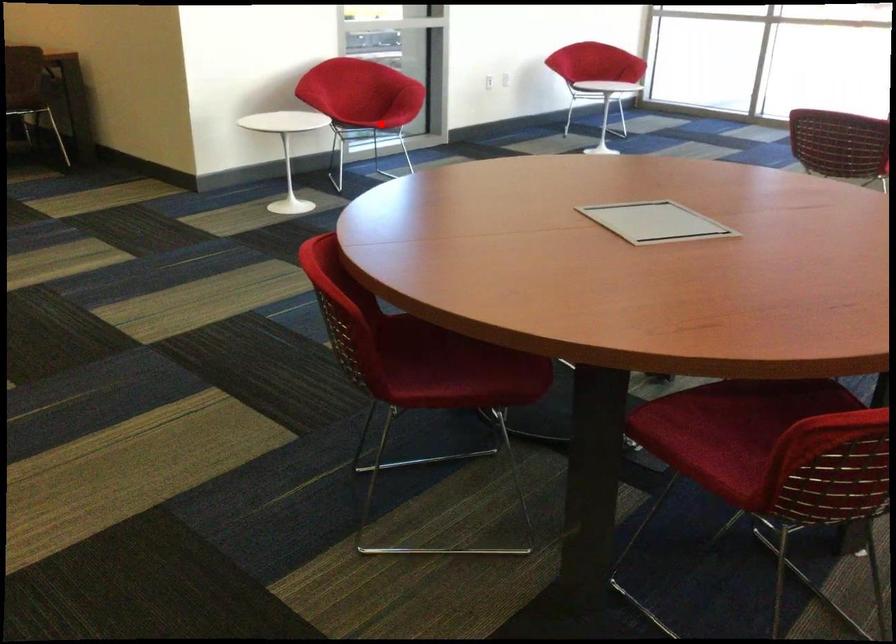
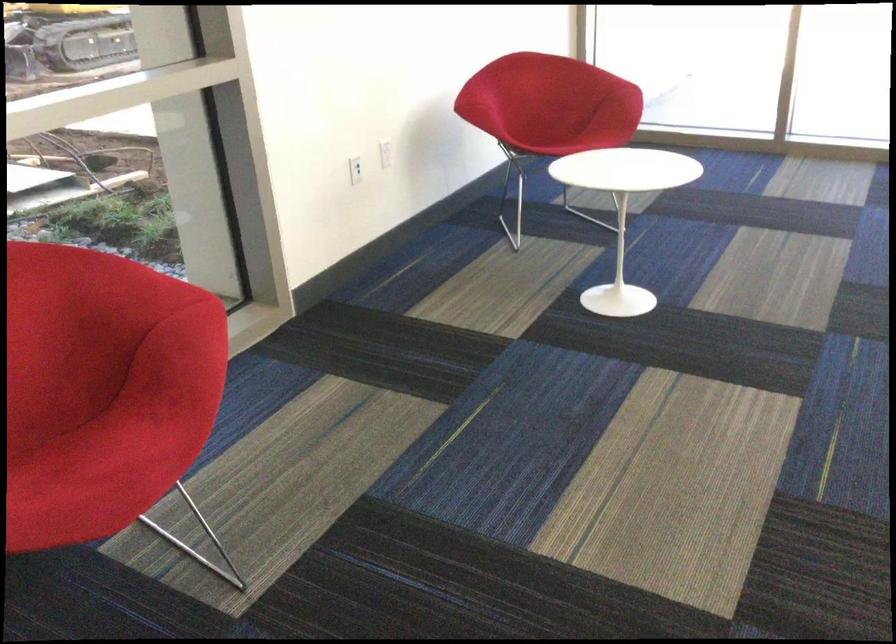
Question: I am providing you with two images of the same scene from different viewpoints. Given a red point in image1, look at the same physical point in image2. Is it:

Choices:
 (A) Closer to the viewpoint
 (B) Farther from the viewpoint

Answer: (A)